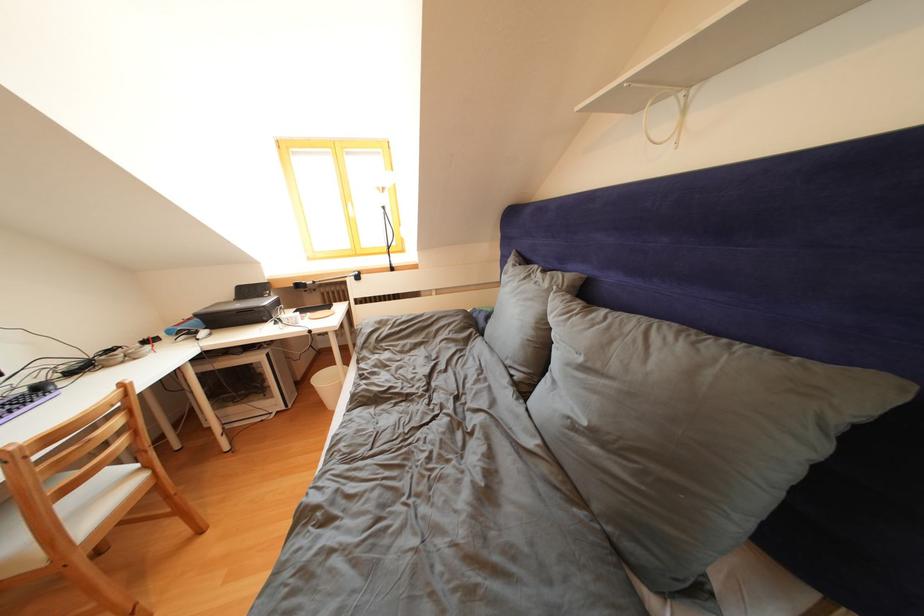
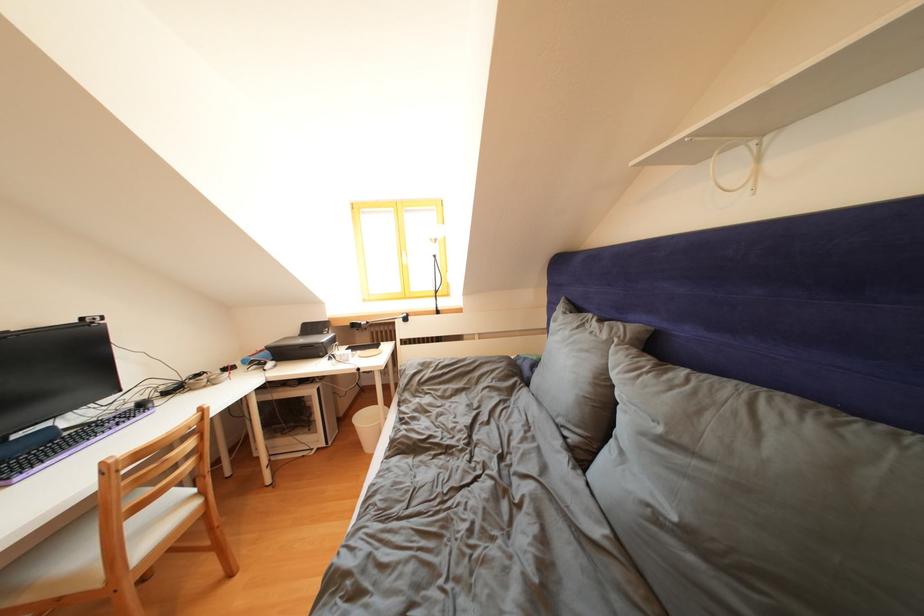
The point at [116,498] is marked in the first image. Where is the corresponding point in the second image?

(175, 522)